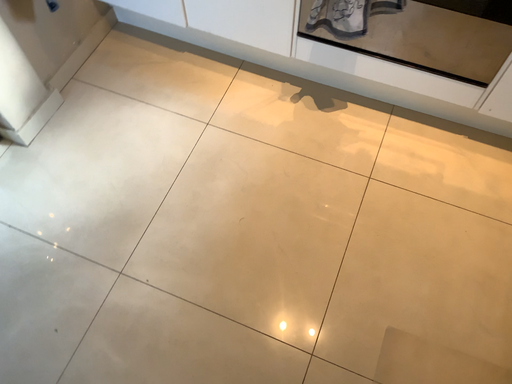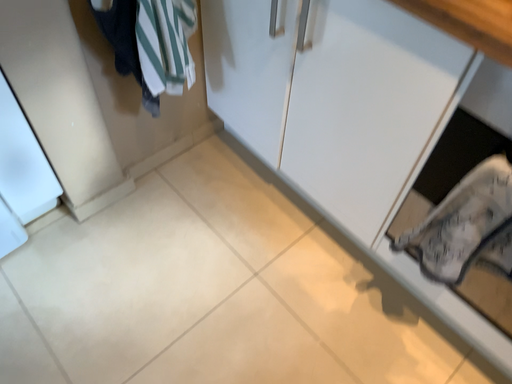
Question: How did the camera likely rotate when shooting the video?

Choices:
 (A) rotated upward
 (B) rotated downward

Answer: (A)